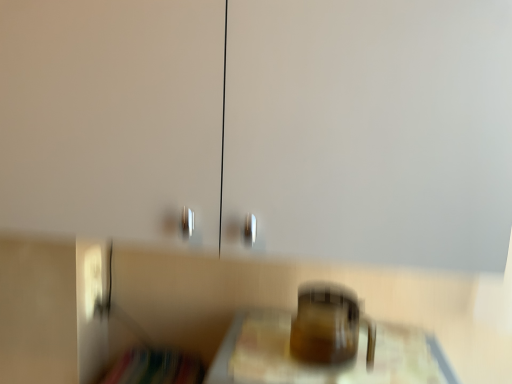
The image size is (512, 384). What do you see at coordinates (324, 366) in the screenshot?
I see `translucent glass jar at center` at bounding box center [324, 366].

Where is `translucent glass jar at center`? translucent glass jar at center is located at coordinates (324, 366).

Where is `translucent glass mug at center`? translucent glass mug at center is located at coordinates (329, 326).

What do you see at coordinates (329, 326) in the screenshot? The height and width of the screenshot is (384, 512). I see `translucent glass mug at center` at bounding box center [329, 326].

This screenshot has width=512, height=384. Find the location of `translucent glass jar at center`. translucent glass jar at center is located at coordinates (324, 366).

Between translucent glass mug at center and translucent glass jar at center, which one appears on the left side from the viewer's perspective?

Positioned to the left is translucent glass mug at center.

Considering the positions of objects translucent glass mug at center and translucent glass jar at center in the image provided, who is behind, translucent glass mug at center or translucent glass jar at center?

translucent glass mug at center is more distant.

Which is behind, point (340, 350) or point (246, 313)?

Point (246, 313)

From the image's perspective, is translucent glass mug at center located above translucent glass jar at center?

Yes.

From a real-world perspective, relative to translucent glass jar at center, is translucent glass mug at center vertically above or below?

translucent glass mug at center is above translucent glass jar at center.

Looking at their sizes, would you say translucent glass mug at center is wider or thinner than translucent glass jar at center?

translucent glass mug at center is thinner than translucent glass jar at center.

Considering the sizes of translucent glass mug at center and translucent glass jar at center in the image, is translucent glass mug at center taller or shorter than translucent glass jar at center?

Considering their sizes, translucent glass mug at center has less height than translucent glass jar at center.

Which of these two, translucent glass mug at center or translucent glass jar at center, is smaller?

translucent glass mug at center is smaller.

Is translucent glass mug at center inside the boundaries of translucent glass jar at center, or outside?

translucent glass mug at center exists outside the volume of translucent glass jar at center.

Consider the image. Is translucent glass mug at center directly adjacent to translucent glass jar at center?

Absolutely, translucent glass mug at center is next to and touching translucent glass jar at center.

Could you tell me if translucent glass mug at center is turned towards translucent glass jar at center?

No, translucent glass mug at center is not aimed at translucent glass jar at center.

What's the angular difference between translucent glass mug at center and translucent glass jar at center's facing directions?

0.000596 degrees separate the facing orientations of translucent glass mug at center and translucent glass jar at center.

Locate an element on the screen. furniture in front of the translucent glass mug at center is located at coordinates (324, 366).

Considering the positions of objects translucent glass jar at center and translucent glass mug at center in the image provided, who is more to the right, translucent glass jar at center or translucent glass mug at center?

From the viewer's perspective, translucent glass jar at center appears more on the right side.

Considering their positions, is translucent glass jar at center located in front of or behind translucent glass mug at center?

translucent glass jar at center is positioned closer to the viewer than translucent glass mug at center.

Which is more distant, (448, 380) or (342, 295)?

The point (342, 295) is farther from the camera.

From the image's perspective, would you say translucent glass jar at center is positioned over translucent glass mug at center?

No, from the image's perspective, translucent glass jar at center is not over translucent glass mug at center.

From a real-world perspective, is translucent glass jar at center physically below translucent glass mug at center?

Yes.

Between translucent glass jar at center and translucent glass mug at center, which one has smaller width?

translucent glass mug at center.

Which of these two, translucent glass jar at center or translucent glass mug at center, stands shorter?

translucent glass mug at center is shorter.

Which of these two, translucent glass jar at center or translucent glass mug at center, is bigger?

translucent glass jar at center.

From the picture: Would you say translucent glass jar at center contains translucent glass mug at center?

No, translucent glass mug at center is not a part of translucent glass jar at center.

Based on the photo, is there a large distance between translucent glass jar at center and translucent glass mug at center?

No, translucent glass jar at center is in close proximity to translucent glass mug at center.

Does translucent glass jar at center turn towards translucent glass mug at center?

No.

From the picture: How many degrees apart are the facing directions of translucent glass jar at center and translucent glass mug at center?

translucent glass jar at center and translucent glass mug at center are facing 0.000596 degrees away from each other.

This screenshot has width=512, height=384. Find the location of `appliance behind the translucent glass jar at center`. appliance behind the translucent glass jar at center is located at coordinates (329, 326).

Image resolution: width=512 pixels, height=384 pixels. What are the coordinates of `appliance behind the translucent glass jar at center` in the screenshot? It's located at (329, 326).

Where is `appliance located above the translucent glass jar at center (from a real-world perspective)`? The image size is (512, 384). appliance located above the translucent glass jar at center (from a real-world perspective) is located at coordinates (329, 326).